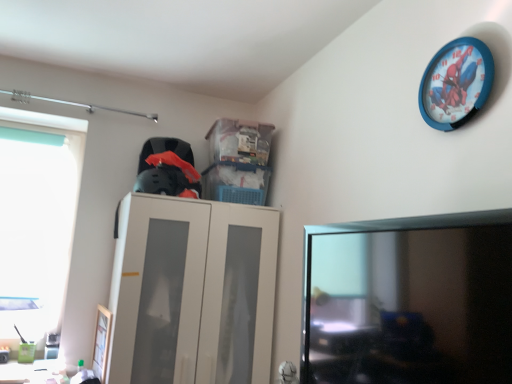
Question: Based on their sizes in the image, would you say beige matte cabinet at center is bigger or smaller than black glossy monitor at lower right?

Choices:
 (A) small
 (B) big

Answer: (B)

Question: Does point (183, 360) appear closer or farther from the camera than point (347, 357)?

Choices:
 (A) closer
 (B) farther

Answer: (B)

Question: Which object is the closest to the wooden picture frame at lower left?

Choices:
 (A) blue plastic wall clock at upper right
 (B) transparent plastic window at left
 (C) beige matte cabinet at center
 (D) black glossy monitor at lower right

Answer: (C)

Question: Which is nearer to the black glossy monitor at lower right?

Choices:
 (A) transparent plastic window at left
 (B) blue plastic wall clock at upper right
 (C) beige matte cabinet at center
 (D) wooden picture frame at lower left

Answer: (B)